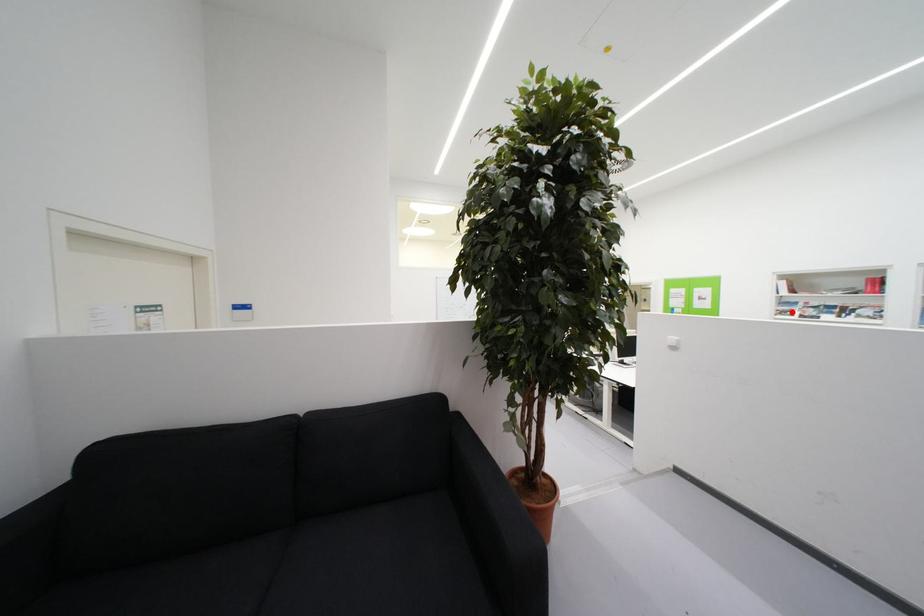
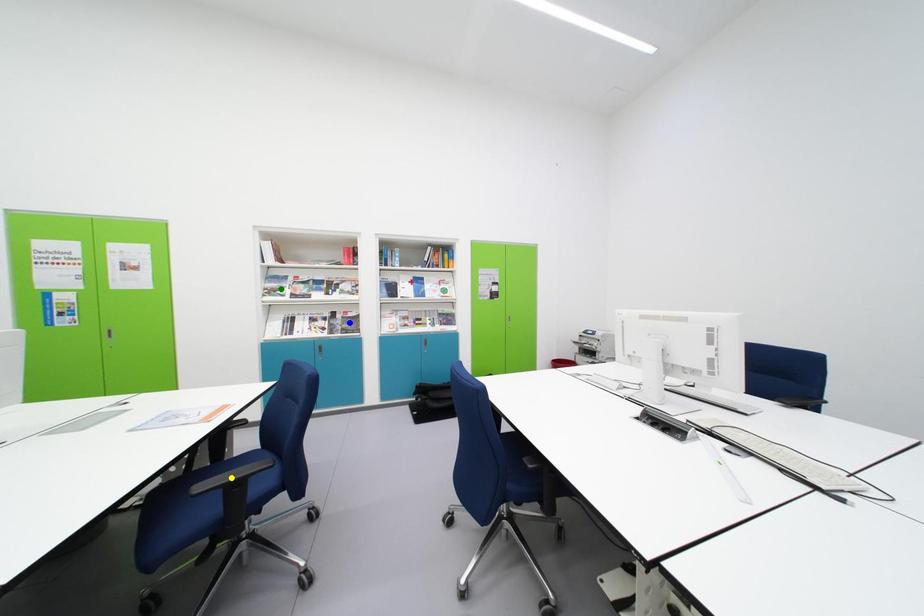
Question: I am providing you with two images of the same scene from different viewpoints. A red point is marked on the first image. You are given multiple points on the second image. In image 2, which mark is for the same physical point as the one in image 1?

Choices:
 (A) yellow point
 (B) blue point
 (C) green point

Answer: (C)